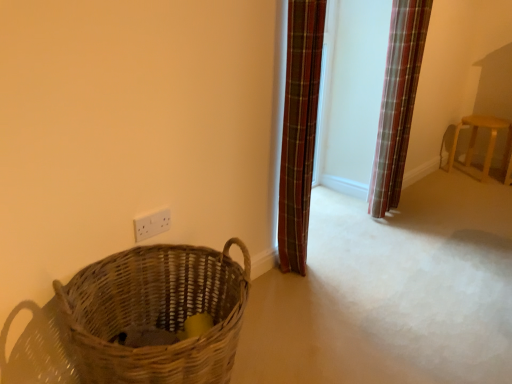
Image resolution: width=512 pixels, height=384 pixels. In order to click on white plastic electric outlet at lower left in this screenshot , I will do `click(152, 224)`.

What is the approximate width of woven brown basket at lower left?

woven brown basket at lower left is 20.48 inches wide.

Describe the element at coordinates (398, 101) in the screenshot. This screenshot has width=512, height=384. I see `plaid fabric curtain at right, which appears as the first curtain when viewed from the back` at that location.

Where is `white plastic electric outlet at lower left`? The height and width of the screenshot is (384, 512). white plastic electric outlet at lower left is located at coordinates (152, 224).

Can you confirm if plaid fabric curtain at right, the first curtain when ordered from right to left, is positioned to the left of white plastic electric outlet at lower left?

Incorrect, plaid fabric curtain at right, the first curtain when ordered from right to left, is not on the left side of white plastic electric outlet at lower left.

Is plaid fabric curtain at right, which appears as the first curtain when viewed from the back, not near white plastic electric outlet at lower left?

Yes.

Considering the relative positions of plaid fabric curtain at right, positioned as the second curtain in left-to-right order, and white plastic electric outlet at lower left in the image provided, is plaid fabric curtain at right, positioned as the second curtain in left-to-right order, behind white plastic electric outlet at lower left?

Yes, plaid fabric curtain at right, positioned as the second curtain in left-to-right order, is further from the viewer.

Considering the sizes of woven brown basket at lower left and plaid fabric curtain at center, positioned as the second curtain in right-to-left order, in the image, is woven brown basket at lower left taller or shorter than plaid fabric curtain at center, positioned as the second curtain in right-to-left order,?

woven brown basket at lower left is shorter than plaid fabric curtain at center, positioned as the second curtain in right-to-left order.

Is woven brown basket at lower left turned away from plaid fabric curtain at center, which is the second curtain in back-to-front order?

No.

Can plaid fabric curtain at center, which is the second curtain in back-to-front order, be found inside woven brown basket at lower left?

No, woven brown basket at lower left does not contain plaid fabric curtain at center, which is the second curtain in back-to-front order.

What's the angular difference between wooden stool at right and plaid fabric curtain at right, positioned as the second curtain in left-to-right order,'s facing directions?

There is a 86-degree angle between the facing directions of wooden stool at right and plaid fabric curtain at right, positioned as the second curtain in left-to-right order.

Can you confirm if wooden stool at right is smaller than plaid fabric curtain at right, which appears as the first curtain when viewed from the back?

Indeed, wooden stool at right has a smaller size compared to plaid fabric curtain at right, which appears as the first curtain when viewed from the back.

Which point is more forward, (455,141) or (415,5)?

The point (415,5) is closer to the camera.

Would you say wooden stool at right is to the left or to the right of plaid fabric curtain at right, which appears as the first curtain when viewed from the back, in the picture?

wooden stool at right is to the right of plaid fabric curtain at right, which appears as the first curtain when viewed from the back.

From the image's perspective, is plaid fabric curtain at center, the 1th curtain positioned from the front, beneath plaid fabric curtain at right, the first curtain when ordered from right to left?

Yes.

Considering the sizes of objects plaid fabric curtain at center, the 1th curtain positioned from the front, and plaid fabric curtain at right, positioned as the second curtain in left-to-right order, in the image provided, who is bigger, plaid fabric curtain at center, the 1th curtain positioned from the front, or plaid fabric curtain at right, positioned as the second curtain in left-to-right order,?

plaid fabric curtain at right, positioned as the second curtain in left-to-right order.

Considering the relative positions of plaid fabric curtain at center, positioned as the second curtain in right-to-left order, and plaid fabric curtain at right, positioned as the second curtain in left-to-right order, in the image provided, is plaid fabric curtain at center, positioned as the second curtain in right-to-left order, behind plaid fabric curtain at right, positioned as the second curtain in left-to-right order,?

No.

Is plaid fabric curtain at center, which is the second curtain in back-to-front order, facing towards plaid fabric curtain at right, which ranks as the second curtain in front-to-back order?

No, plaid fabric curtain at center, which is the second curtain in back-to-front order, is not facing towards plaid fabric curtain at right, which ranks as the second curtain in front-to-back order.

Considering the sizes of objects wooden stool at right and plaid fabric curtain at center, placed as the first curtain when sorted from left to right, in the image provided, who is shorter, wooden stool at right or plaid fabric curtain at center, placed as the first curtain when sorted from left to right,?

Standing shorter between the two is wooden stool at right.

Is wooden stool at right in contact with plaid fabric curtain at center, positioned as the second curtain in right-to-left order?

No, wooden stool at right is not in contact with plaid fabric curtain at center, positioned as the second curtain in right-to-left order.

Considering the relative positions of wooden stool at right and plaid fabric curtain at center, placed as the first curtain when sorted from left to right, in the image provided, is wooden stool at right to the left or to the right of plaid fabric curtain at center, placed as the first curtain when sorted from left to right,?

wooden stool at right is to the right of plaid fabric curtain at center, placed as the first curtain when sorted from left to right.

Considering the positions of points (139, 226) and (497, 119), is point (139, 226) closer to camera compared to point (497, 119)?

That is True.

Relative to wooden stool at right, is white plastic electric outlet at lower left in front or behind?

In the image, white plastic electric outlet at lower left appears in front of wooden stool at right.

Is white plastic electric outlet at lower left not close to wooden stool at right?

Indeed, white plastic electric outlet at lower left is not near wooden stool at right.

Is white plastic electric outlet at lower left at the right side of wooden stool at right?

In fact, white plastic electric outlet at lower left is to the left of wooden stool at right.

Is white plastic electric outlet at lower left aimed at plaid fabric curtain at center, placed as the first curtain when sorted from left to right?

No, white plastic electric outlet at lower left is not oriented towards plaid fabric curtain at center, placed as the first curtain when sorted from left to right.

Does white plastic electric outlet at lower left appear on the left side of plaid fabric curtain at center, which is the second curtain in back-to-front order?

Yes, white plastic electric outlet at lower left is to the left of plaid fabric curtain at center, which is the second curtain in back-to-front order.

Considering the relative sizes of white plastic electric outlet at lower left and plaid fabric curtain at center, positioned as the second curtain in right-to-left order, in the image provided, is white plastic electric outlet at lower left wider than plaid fabric curtain at center, positioned as the second curtain in right-to-left order,?

No, white plastic electric outlet at lower left is not wider than plaid fabric curtain at center, positioned as the second curtain in right-to-left order.

Is white plastic electric outlet at lower left not within plaid fabric curtain at center, the 1th curtain positioned from the front?

Yes, white plastic electric outlet at lower left is not within plaid fabric curtain at center, the 1th curtain positioned from the front.

Find the location of a particular element. This screenshot has height=384, width=512. electric outlet that appears below the plaid fabric curtain at right, which appears as the first curtain when viewed from the back (from a real-world perspective) is located at coordinates (152, 224).

This screenshot has height=384, width=512. What are the coordinates of `curtain that is the 1st object located above the woven brown basket at lower left (from the image's perspective)` in the screenshot? It's located at (298, 130).

Looking at the image, which one is located closer to woven brown basket at lower left, plaid fabric curtain at center, placed as the first curtain when sorted from left to right, or plaid fabric curtain at right, the first curtain when ordered from right to left?

plaid fabric curtain at center, placed as the first curtain when sorted from left to right, lies closer to woven brown basket at lower left than the other object.

Estimate the real-world distances between objects in this image. Which object is further from wooden stool at right, plaid fabric curtain at right, which ranks as the second curtain in front-to-back order, or white plastic electric outlet at lower left?

white plastic electric outlet at lower left.

When comparing their distances from wooden stool at right, does plaid fabric curtain at center, which is the second curtain in back-to-front order, or white plastic electric outlet at lower left seem closer?

The object closer to wooden stool at right is plaid fabric curtain at center, which is the second curtain in back-to-front order.

When comparing their distances from white plastic electric outlet at lower left, does plaid fabric curtain at right, the first curtain when ordered from right to left, or woven brown basket at lower left seem closer?

woven brown basket at lower left is positioned closer to the anchor white plastic electric outlet at lower left.

Considering their positions, is woven brown basket at lower left positioned further to wooden stool at right than plaid fabric curtain at right, positioned as the second curtain in left-to-right order?

Based on the image, woven brown basket at lower left appears to be further to wooden stool at right.

When comparing their distances from wooden stool at right, does woven brown basket at lower left or white plastic electric outlet at lower left seem further?

The object further to wooden stool at right is woven brown basket at lower left.

Estimate the real-world distances between objects in this image. Which object is closer to wooden stool at right, plaid fabric curtain at center, placed as the first curtain when sorted from left to right, or woven brown basket at lower left?

Based on the image, plaid fabric curtain at center, placed as the first curtain when sorted from left to right, appears to be nearer to wooden stool at right.

Which object lies further to the anchor point white plastic electric outlet at lower left, plaid fabric curtain at right, positioned as the second curtain in left-to-right order, or plaid fabric curtain at center, positioned as the second curtain in right-to-left order?

plaid fabric curtain at right, positioned as the second curtain in left-to-right order, is further to white plastic electric outlet at lower left.

This screenshot has width=512, height=384. I want to click on curtain situated between plaid fabric curtain at center, the 1th curtain positioned from the front, and wooden stool at right from left to right, so click(x=398, y=101).

I want to click on curtain between woven brown basket at lower left and plaid fabric curtain at right, positioned as the second curtain in left-to-right order, from front to back, so click(298, 130).

I want to click on electric outlet positioned between woven brown basket at lower left and plaid fabric curtain at center, placed as the first curtain when sorted from left to right, from near to far, so click(x=152, y=224).

I want to click on basket situated between white plastic electric outlet at lower left and plaid fabric curtain at right, which appears as the first curtain when viewed from the back, from left to right, so click(x=155, y=313).